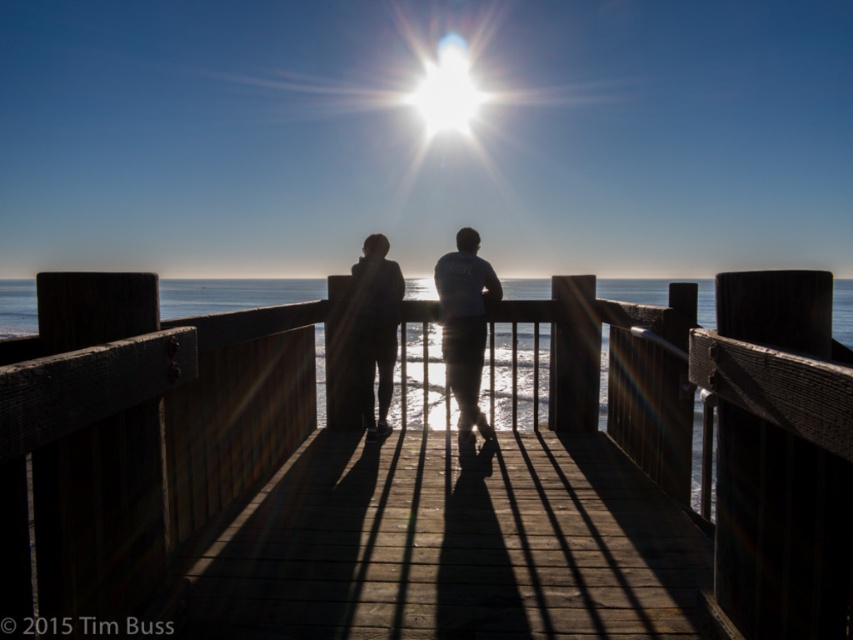
Which of these two, silhouette clothing at center or white cotton shirt at center, stands taller?

Standing taller between the two is white cotton shirt at center.

What are the coordinates of `silhouette clothing at center` in the screenshot? It's located at (465, 324).

I want to click on silhouette clothing at center, so click(465, 324).

Is transparent water at center in front of white cotton shirt at center?

That is True.

Does transparent water at center have a lesser width compared to white cotton shirt at center?

In fact, transparent water at center might be wider than white cotton shirt at center.

Which is in front, point (190, 282) or point (463, 436)?

Point (463, 436)

I want to click on transparent water at center, so click(231, 294).

Who is more forward, (415, 406) or (357, 285)?

Point (357, 285)

Between transparent water at center and silhouette fabric at center, which one has less height?

Standing shorter between the two is silhouette fabric at center.

Who is more forward, (219,298) or (364,257)?

Point (364,257) is in front.

Where is `transparent water at center`? The width and height of the screenshot is (853, 640). transparent water at center is located at coordinates (231, 294).